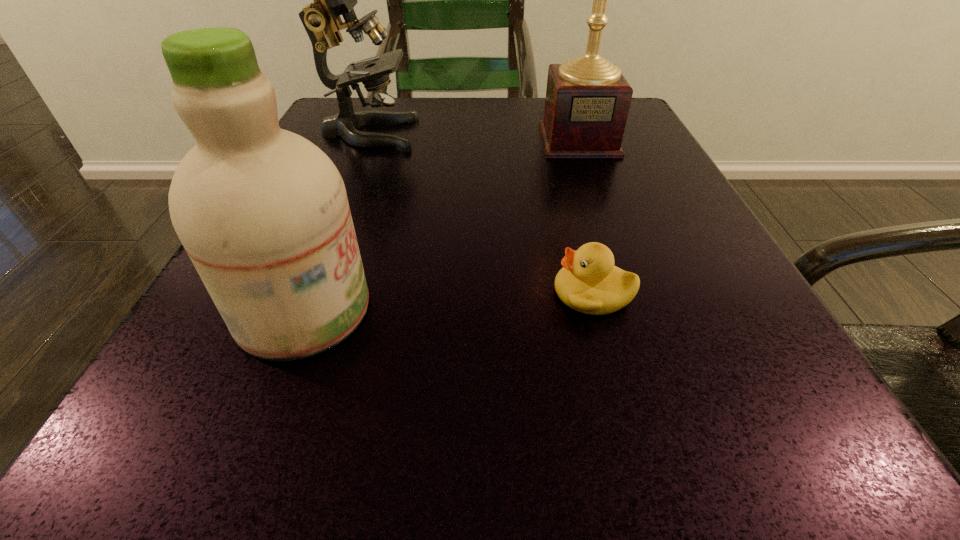
Locate an element on the screen. Image resolution: width=960 pixels, height=540 pixels. trophy cup is located at coordinates (587, 102).

Find the location of a particular element. This screenshot has width=960, height=540. microscope is located at coordinates (321, 19).

Image resolution: width=960 pixels, height=540 pixels. I want to click on the third tallest object, so click(x=262, y=212).

Identify the location of duckling. This screenshot has height=540, width=960. coord(589,282).

You are a GUI agent. You are given a task and a screenshot of the screen. Output one action in this format:
    pyautogui.click(x=<x>, y=<y>)
    Task: Click on the vacant space positioned 0.110m on the plaque of the tallest object
    This screenshot has width=960, height=540.
    Given the screenshot: What is the action you would take?
    pyautogui.click(x=597, y=191)

Where is `blank space located 0.130m at the eyepieces of the microscope`? blank space located 0.130m at the eyepieces of the microscope is located at coordinates (482, 133).

This screenshot has height=540, width=960. In order to click on vacant area situated 0.100m on the front label of the cleansing agent in this screenshot , I will do `click(454, 309)`.

Where is `free spot located at the face of the shortest object`? The image size is (960, 540). free spot located at the face of the shortest object is located at coordinates (349, 293).

This screenshot has width=960, height=540. Identify the location of vacant position located 0.140m at the face of the shortest object. (440, 293).

Find the location of a particular element. vacant region located at the face of the shortest object is located at coordinates (227, 293).